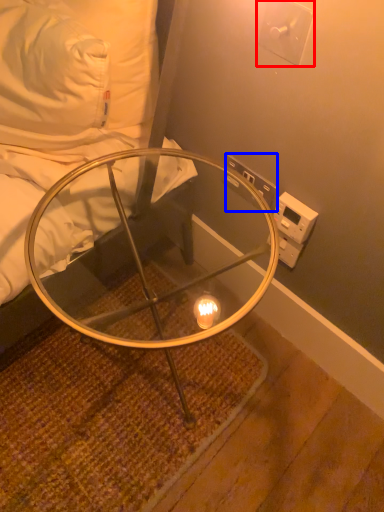
Question: Which of the following is the farthest to the observer, electric outlet (highlighted by a red box) or electric outlet (highlighted by a blue box)?

Choices:
 (A) electric outlet
 (B) electric outlet

Answer: (B)